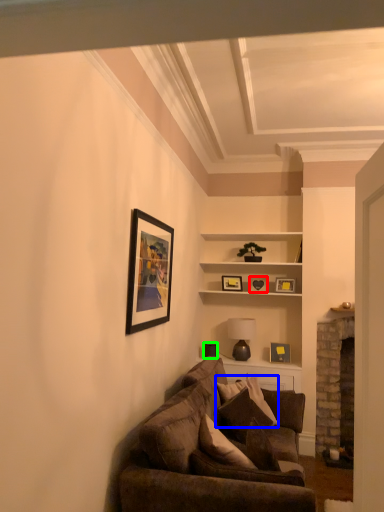
Question: Estimate the real-world distances between objects in this image. Which object is closer to picture frame (highlighted by a red box), pillow (highlighted by a blue box) or picture frame (highlighted by a green box)?

Choices:
 (A) pillow
 (B) picture frame

Answer: (B)